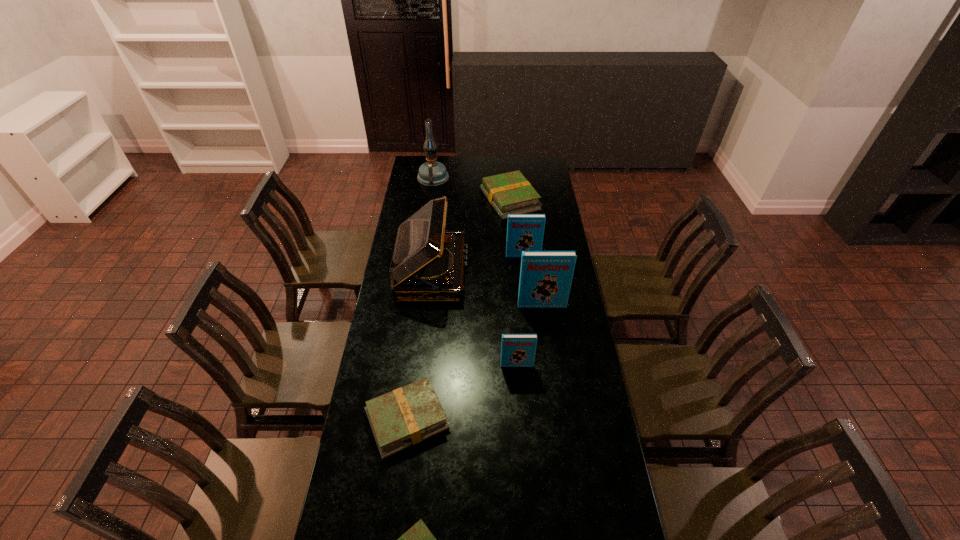
Locate an element on the screen. This screenshot has height=540, width=960. oil lamp is located at coordinates (432, 173).

Locate an element on the screen. record player is located at coordinates (427, 265).

In order to click on the second farthest blue book in this screenshot , I will do `click(545, 276)`.

The height and width of the screenshot is (540, 960). I want to click on the biggest blue book, so click(x=545, y=276).

The height and width of the screenshot is (540, 960). Find the location of `the farthest blue book`. the farthest blue book is located at coordinates (525, 232).

The width and height of the screenshot is (960, 540). Find the location of `the second smallest blue book`. the second smallest blue book is located at coordinates (525, 232).

Identify the location of the third tallest book. The width and height of the screenshot is (960, 540). (517, 350).

Where is `the fifth tallest object`? the fifth tallest object is located at coordinates (517, 350).

The width and height of the screenshot is (960, 540). Find the location of `the third shortest book`. the third shortest book is located at coordinates (509, 193).

Locate an element on the screen. The height and width of the screenshot is (540, 960). the sixth tallest object is located at coordinates (509, 193).